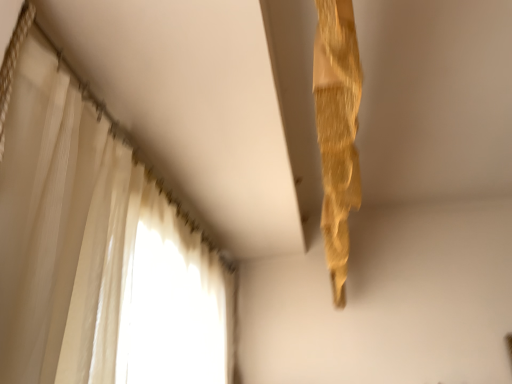
The height and width of the screenshot is (384, 512). What do you see at coordinates (337, 130) in the screenshot?
I see `gold textured curtain at upper right, which appears as the 2th curtain when viewed from the left` at bounding box center [337, 130].

This screenshot has height=384, width=512. I want to click on gold textured curtain at upper right, the 1th curtain in the right-to-left sequence, so click(337, 130).

This screenshot has height=384, width=512. What do you see at coordinates (95, 246) in the screenshot?
I see `white sheer curtain at left, arranged as the 2th curtain when viewed from the right` at bounding box center [95, 246].

Locate an element on the screen. white sheer curtain at left, arranged as the 2th curtain when viewed from the right is located at coordinates (95, 246).

Image resolution: width=512 pixels, height=384 pixels. I want to click on gold textured curtain at upper right, the 1th curtain in the right-to-left sequence, so click(x=337, y=130).

Which is more to the left, white sheer curtain at left, which appears as the 1th curtain when viewed from the left, or gold textured curtain at upper right, which appears as the 2th curtain when viewed from the left?

white sheer curtain at left, which appears as the 1th curtain when viewed from the left, is more to the left.

Between white sheer curtain at left, which appears as the 1th curtain when viewed from the left, and gold textured curtain at upper right, which appears as the 2th curtain when viewed from the left, which one is positioned behind?

gold textured curtain at upper right, which appears as the 2th curtain when viewed from the left, is more distant.

Is point (83, 208) behind point (342, 157)?

Yes, point (83, 208) is farther from viewer.

From the image's perspective, is white sheer curtain at left, arranged as the 2th curtain when viewed from the right, positioned above or below gold textured curtain at upper right, the 1th curtain in the right-to-left sequence?

white sheer curtain at left, arranged as the 2th curtain when viewed from the right, is situated higher than gold textured curtain at upper right, the 1th curtain in the right-to-left sequence, in the image.

From a real-world perspective, between white sheer curtain at left, arranged as the 2th curtain when viewed from the right, and gold textured curtain at upper right, the 1th curtain in the right-to-left sequence, who is vertically lower?

gold textured curtain at upper right, the 1th curtain in the right-to-left sequence, from a real-world perspective.

Which of these two, white sheer curtain at left, which appears as the 1th curtain when viewed from the left, or gold textured curtain at upper right, the 1th curtain in the right-to-left sequence, is wider?

Wider between the two is white sheer curtain at left, which appears as the 1th curtain when viewed from the left.

Looking at this image, between white sheer curtain at left, which appears as the 1th curtain when viewed from the left, and gold textured curtain at upper right, the 1th curtain in the right-to-left sequence, which one has less height?

With less height is white sheer curtain at left, which appears as the 1th curtain when viewed from the left.

Based on the photo, between white sheer curtain at left, arranged as the 2th curtain when viewed from the right, and gold textured curtain at upper right, which appears as the 2th curtain when viewed from the left, which one has larger size?

white sheer curtain at left, arranged as the 2th curtain when viewed from the right.

Would you say gold textured curtain at upper right, which appears as the 2th curtain when viewed from the left, is part of white sheer curtain at left, which appears as the 1th curtain when viewed from the left,'s contents?

That's incorrect, gold textured curtain at upper right, which appears as the 2th curtain when viewed from the left, is not inside white sheer curtain at left, which appears as the 1th curtain when viewed from the left.

Consider the image. Can you see white sheer curtain at left, which appears as the 1th curtain when viewed from the left, touching gold textured curtain at upper right, the 1th curtain in the right-to-left sequence?

No.

Consider the image. Does white sheer curtain at left, which appears as the 1th curtain when viewed from the left, turn towards gold textured curtain at upper right, the 1th curtain in the right-to-left sequence?

Yes, white sheer curtain at left, which appears as the 1th curtain when viewed from the left, is oriented towards gold textured curtain at upper right, the 1th curtain in the right-to-left sequence.

Measure the distance from white sheer curtain at left, which appears as the 1th curtain when viewed from the left, to gold textured curtain at upper right, which appears as the 2th curtain when viewed from the left.

white sheer curtain at left, which appears as the 1th curtain when viewed from the left, and gold textured curtain at upper right, which appears as the 2th curtain when viewed from the left, are 24.92 inches apart.

Find the location of a particular element. This screenshot has width=512, height=384. curtain below the white sheer curtain at left, arranged as the 2th curtain when viewed from the right (from a real-world perspective) is located at coordinates (337, 130).

Based on their positions, is gold textured curtain at upper right, which appears as the 2th curtain when viewed from the left, located to the left or right of white sheer curtain at left, which appears as the 1th curtain when viewed from the left?

gold textured curtain at upper right, which appears as the 2th curtain when viewed from the left, is to the right of white sheer curtain at left, which appears as the 1th curtain when viewed from the left.

Is gold textured curtain at upper right, which appears as the 2th curtain when viewed from the left, further to camera compared to white sheer curtain at left, which appears as the 1th curtain when viewed from the left?

Yes, it is behind white sheer curtain at left, which appears as the 1th curtain when viewed from the left.

Is point (344, 84) farther from camera compared to point (116, 226)?

That is False.

From the image's perspective, between gold textured curtain at upper right, the 1th curtain in the right-to-left sequence, and white sheer curtain at left, which appears as the 1th curtain when viewed from the left, which one is located above?

white sheer curtain at left, which appears as the 1th curtain when viewed from the left, from the image's perspective.

From a real-world perspective, who is located lower, gold textured curtain at upper right, which appears as the 2th curtain when viewed from the left, or white sheer curtain at left, arranged as the 2th curtain when viewed from the right?

gold textured curtain at upper right, which appears as the 2th curtain when viewed from the left, from a real-world perspective.

Does gold textured curtain at upper right, which appears as the 2th curtain when viewed from the left, have a lesser width compared to white sheer curtain at left, arranged as the 2th curtain when viewed from the right?

Yes, gold textured curtain at upper right, which appears as the 2th curtain when viewed from the left, is thinner than white sheer curtain at left, arranged as the 2th curtain when viewed from the right.

Is gold textured curtain at upper right, the 1th curtain in the right-to-left sequence, shorter than white sheer curtain at left, arranged as the 2th curtain when viewed from the right?

No.

Does gold textured curtain at upper right, which appears as the 2th curtain when viewed from the left, have a larger size compared to white sheer curtain at left, which appears as the 1th curtain when viewed from the left?

Actually, gold textured curtain at upper right, which appears as the 2th curtain when viewed from the left, might be smaller than white sheer curtain at left, which appears as the 1th curtain when viewed from the left.

Would you say white sheer curtain at left, which appears as the 1th curtain when viewed from the left, is part of gold textured curtain at upper right, the 1th curtain in the right-to-left sequence,'s contents?

No, white sheer curtain at left, which appears as the 1th curtain when viewed from the left, is not inside gold textured curtain at upper right, the 1th curtain in the right-to-left sequence.

Based on the photo, is there a large distance between gold textured curtain at upper right, which appears as the 2th curtain when viewed from the left, and white sheer curtain at left, which appears as the 1th curtain when viewed from the left?

No, gold textured curtain at upper right, which appears as the 2th curtain when viewed from the left, is in close proximity to white sheer curtain at left, which appears as the 1th curtain when viewed from the left.

Is gold textured curtain at upper right, the 1th curtain in the right-to-left sequence, facing towards white sheer curtain at left, which appears as the 1th curtain when viewed from the left?

No, gold textured curtain at upper right, the 1th curtain in the right-to-left sequence, is not oriented towards white sheer curtain at left, which appears as the 1th curtain when viewed from the left.

The image size is (512, 384). Identify the location of curtain above the gold textured curtain at upper right, which appears as the 2th curtain when viewed from the left (from a real-world perspective). (95, 246).

You are a GUI agent. You are given a task and a screenshot of the screen. Output one action in this format:
    pyautogui.click(x=<x>, y=<y>)
    Task: Click on the curtain above the gold textured curtain at upper right, the 1th curtain in the right-to-left sequence (from the image's perspective)
    
    Given the screenshot: What is the action you would take?
    pyautogui.click(x=95, y=246)

In the image, there is a white sheer curtain at left, arranged as the 2th curtain when viewed from the right. At what (x,y) coordinates should I click in order to perform the action: click on curtain below it (from the image's perspective). Please return your answer as a coordinate pair (x, y). Looking at the image, I should click on (337, 130).